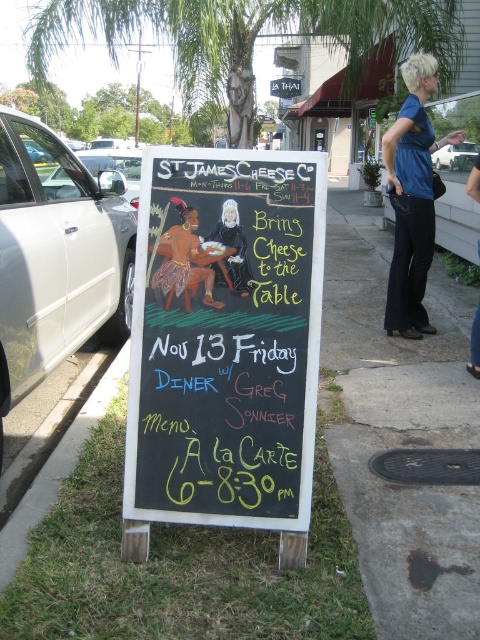
Who is taller, gray concrete sidewalk at center or gray concrete curb at lower left?

With more height is gray concrete sidewalk at center.

In the scene shown: Measure the distance between gray concrete sidewalk at center and camera.

gray concrete sidewalk at center is 2.08 meters from camera.

Which is in front, point (465, 570) or point (32, 484)?

Positioned in front is point (465, 570).

The height and width of the screenshot is (640, 480). I want to click on gray concrete sidewalk at center, so click(x=400, y=433).

Does chalkboard menu at center appear on the left side of gray concrete curb at lower left?

In fact, chalkboard menu at center is to the right of gray concrete curb at lower left.

Is chalkboard menu at center below gray concrete curb at lower left?

No.

Is point (201, 442) less distant than point (56, 476)?

Yes, it is in front of point (56, 476).

Find the location of a particular element. Image resolution: width=480 pixels, height=640 pixels. chalkboard menu at center is located at coordinates (220, 420).

Does gray concrete sidewalk at center come behind blue cotton shirt at center?

That is False.

Between gray concrete sidewalk at center and blue cotton shirt at center, which one is positioned higher?

Positioned higher is blue cotton shirt at center.

Locate an element on the screen. This screenshot has width=480, height=640. gray concrete sidewalk at center is located at coordinates (400, 433).